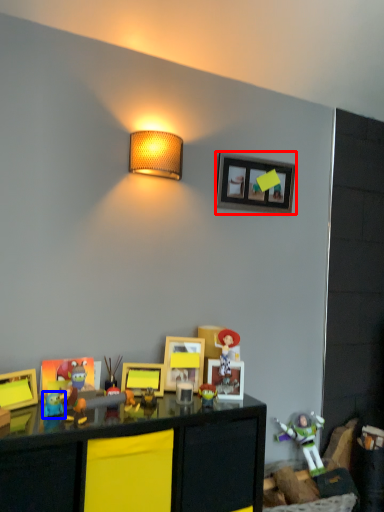
Question: Which object is further to the camera taking this photo, picture frame (highlighted by a red box) or toy (highlighted by a blue box)?

Choices:
 (A) picture frame
 (B) toy

Answer: (A)